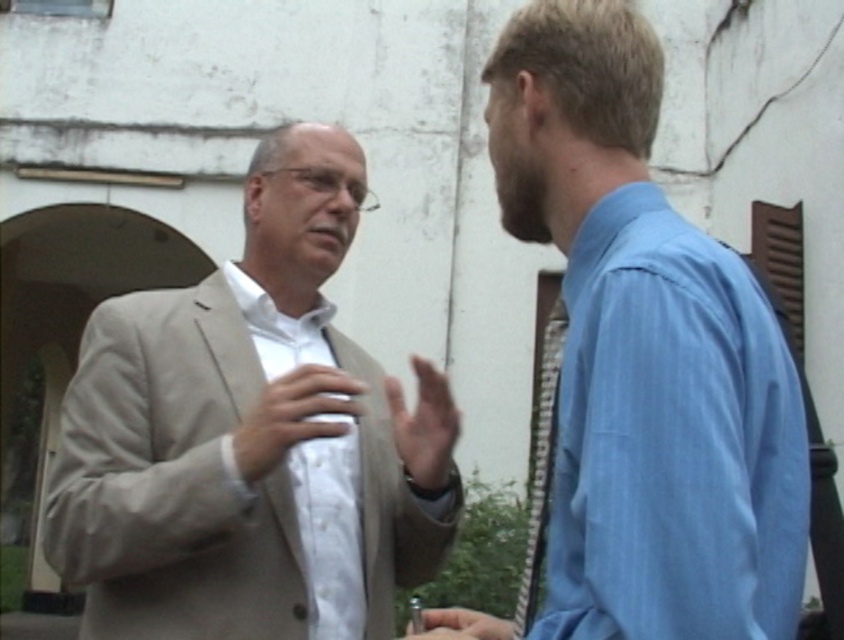
You are standing in the scene and want to walk towards both the point at coordinates point (271,138) and the point at coordinates point (750,484). Which point will you reach first?

You will reach point (271,138) first because it is closer to you than point (750,484), which is further away.

You are a tailor who needs to determine which garment requires more fabric for alterations. Based on the image, which item has a larger width between the light beige suit at center and the white smooth shirt at center?

The light beige suit at center has a larger width than the white smooth shirt at center, so it requires more fabric for alterations.

You are designing a layout for a magazine spread that requires placing two shirts side by side. The blue cotton shirt at right and the white smooth shirt at center must be positioned so that the larger one is on the left side of the page. Based on the image provided, which shirt should be placed on the left side?

The blue cotton shirt at right should be placed on the left side of the page since it has a larger size compared to the white smooth shirt at center.